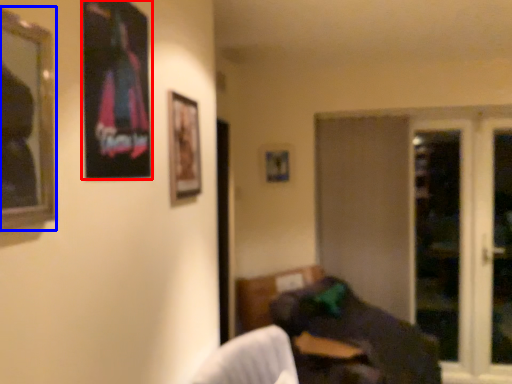
Question: Which of the following is the closest to the observer, picture frame (highlighted by a red box) or picture frame (highlighted by a blue box)?

Choices:
 (A) picture frame
 (B) picture frame

Answer: (B)